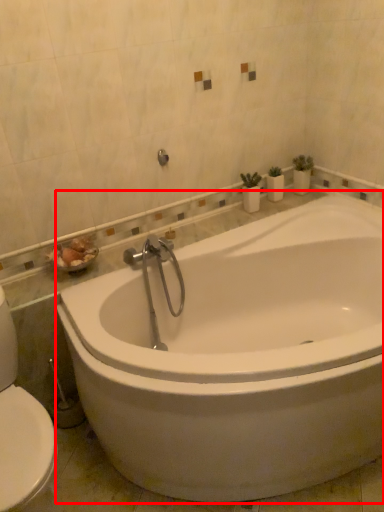
Question: From the image's perspective, where is bathtub (annotated by the red box) located in relation to shower in the image?

Choices:
 (A) above
 (B) below

Answer: (B)